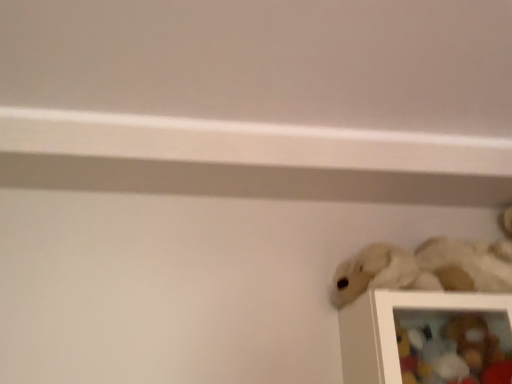
Image resolution: width=512 pixels, height=384 pixels. Find the location of `white plush toy at lower right, which is the 2th toy in top-to-bottom order`. white plush toy at lower right, which is the 2th toy in top-to-bottom order is located at coordinates (412, 353).

You are a GUI agent. You are given a task and a screenshot of the screen. Output one action in this format:
    pyautogui.click(x=<x>, y=<y>)
    Task: Click on the soft plush toy at lower right, the first toy when ordered from bottom to top
    Image resolution: width=512 pixels, height=384 pixels.
    Given the screenshot: What is the action you would take?
    [x=453, y=347]

Measure the distance between point (359, 264) and camera.

The distance of point (359, 264) from camera is 1.26 meters.

Where is `white plush toy at lower right, which is the 2th toy in top-to-bottom order`? The image size is (512, 384). white plush toy at lower right, which is the 2th toy in top-to-bottom order is located at coordinates (412, 353).

Consider the image. From a real-world perspective, is white plush toy at lower right, placed as the 2th toy when sorted from bottom to top, under fuzzy white stuffed animal at lower right, acting as the first toy starting from the top?

Yes, from a real-world perspective, white plush toy at lower right, placed as the 2th toy when sorted from bottom to top, is below fuzzy white stuffed animal at lower right, acting as the first toy starting from the top.

Based on the photo, can you confirm if white plush toy at lower right, which is the 2th toy in top-to-bottom order, is taller than fuzzy white stuffed animal at lower right, acting as the first toy starting from the top?

No.

Which point is more distant from viewer, [400,332] or [402,249]?

Positioned behind is point [402,249].

From the image's perspective, which one is positioned higher, white plush toy at lower right, which is the 2th toy in top-to-bottom order, or fuzzy white stuffed animal at lower right, acting as the first toy starting from the top?

From the image's view, fuzzy white stuffed animal at lower right, acting as the first toy starting from the top, is above.

What's the angular difference between soft plush toy at lower right, which appears as the third toy when viewed from the top, and white plush toy at lower right, placed as the 2th toy when sorted from bottom to top,'s facing directions?

2 degrees.

Is soft plush toy at lower right, the first toy when ordered from bottom to top, taller than white plush toy at lower right, placed as the 2th toy when sorted from bottom to top?

Yes, soft plush toy at lower right, the first toy when ordered from bottom to top, is taller than white plush toy at lower right, placed as the 2th toy when sorted from bottom to top.

Does soft plush toy at lower right, which appears as the third toy when viewed from the top, touch white plush toy at lower right, which is the 2th toy in top-to-bottom order?

Yes, soft plush toy at lower right, which appears as the third toy when viewed from the top, and white plush toy at lower right, which is the 2th toy in top-to-bottom order, clearly make contact.

Is soft plush toy at lower right, which appears as the third toy when viewed from the top, smaller than white plush toy at lower right, placed as the 2th toy when sorted from bottom to top?

No.

Considering the relative positions of fuzzy white stuffed animal at lower right, acting as the first toy starting from the top, and white plush toy at lower right, placed as the 2th toy when sorted from bottom to top, in the image provided, is fuzzy white stuffed animal at lower right, acting as the first toy starting from the top, to the left of white plush toy at lower right, placed as the 2th toy when sorted from bottom to top, from the viewer's perspective?

In fact, fuzzy white stuffed animal at lower right, acting as the first toy starting from the top, is to the right of white plush toy at lower right, placed as the 2th toy when sorted from bottom to top.

Considering the positions of objects fuzzy white stuffed animal at lower right, acting as the first toy starting from the top, and white plush toy at lower right, placed as the 2th toy when sorted from bottom to top, in the image provided, who is behind, fuzzy white stuffed animal at lower right, acting as the first toy starting from the top, or white plush toy at lower right, placed as the 2th toy when sorted from bottom to top,?

white plush toy at lower right, placed as the 2th toy when sorted from bottom to top, is further from the camera.

Can you tell me how much fuzzy white stuffed animal at lower right, acting as the first toy starting from the top, and white plush toy at lower right, placed as the 2th toy when sorted from bottom to top, differ in facing direction?

The angular difference between fuzzy white stuffed animal at lower right, acting as the first toy starting from the top, and white plush toy at lower right, placed as the 2th toy when sorted from bottom to top, is 1.15 degrees.

From a real-world perspective, who is located higher, fuzzy white stuffed animal at lower right, the 3th toy from the bottom, or white plush toy at lower right, which is the 2th toy in top-to-bottom order?

fuzzy white stuffed animal at lower right, the 3th toy from the bottom.

Which object is wider, white plush toy at lower right, placed as the 2th toy when sorted from bottom to top, or soft plush toy at lower right, the first toy when ordered from bottom to top?

white plush toy at lower right, placed as the 2th toy when sorted from bottom to top, is wider.

From a real-world perspective, is white plush toy at lower right, placed as the 2th toy when sorted from bottom to top, above or below soft plush toy at lower right, which appears as the third toy when viewed from the top?

white plush toy at lower right, placed as the 2th toy when sorted from bottom to top, is above soft plush toy at lower right, which appears as the third toy when viewed from the top.

How distant is white plush toy at lower right, which is the 2th toy in top-to-bottom order, from soft plush toy at lower right, which appears as the third toy when viewed from the top?

white plush toy at lower right, which is the 2th toy in top-to-bottom order, and soft plush toy at lower right, which appears as the third toy when viewed from the top, are 9.29 centimeters apart from each other.

Where is `toy that is the 1st object to the left of the soft plush toy at lower right, which appears as the third toy when viewed from the top, starting at the anchor`? The width and height of the screenshot is (512, 384). toy that is the 1st object to the left of the soft plush toy at lower right, which appears as the third toy when viewed from the top, starting at the anchor is located at coordinates click(422, 269).

Which object is further away from the camera, fuzzy white stuffed animal at lower right, acting as the first toy starting from the top, or soft plush toy at lower right, which appears as the third toy when viewed from the top?

soft plush toy at lower right, which appears as the third toy when viewed from the top, is behind.

Can you confirm if fuzzy white stuffed animal at lower right, the 3th toy from the bottom, is positioned to the right of soft plush toy at lower right, which appears as the third toy when viewed from the top?

In fact, fuzzy white stuffed animal at lower right, the 3th toy from the bottom, is to the left of soft plush toy at lower right, which appears as the third toy when viewed from the top.

Looking at their sizes, would you say fuzzy white stuffed animal at lower right, acting as the first toy starting from the top, is wider or thinner than soft plush toy at lower right, the first toy when ordered from bottom to top?

In the image, fuzzy white stuffed animal at lower right, acting as the first toy starting from the top, appears to be wider than soft plush toy at lower right, the first toy when ordered from bottom to top.

Is soft plush toy at lower right, which appears as the third toy when viewed from the top, far from fuzzy white stuffed animal at lower right, the 3th toy from the bottom?

No, soft plush toy at lower right, which appears as the third toy when viewed from the top, is not far from fuzzy white stuffed animal at lower right, the 3th toy from the bottom.

Is soft plush toy at lower right, the first toy when ordered from bottom to top, aimed at fuzzy white stuffed animal at lower right, the 3th toy from the bottom?

No, soft plush toy at lower right, the first toy when ordered from bottom to top, is not oriented towards fuzzy white stuffed animal at lower right, the 3th toy from the bottom.

Is soft plush toy at lower right, the first toy when ordered from bottom to top, at the right side of fuzzy white stuffed animal at lower right, acting as the first toy starting from the top?

Correct, you'll find soft plush toy at lower right, the first toy when ordered from bottom to top, to the right of fuzzy white stuffed animal at lower right, acting as the first toy starting from the top.

From a real-world perspective, is soft plush toy at lower right, which appears as the third toy when viewed from the top, above or below fuzzy white stuffed animal at lower right, the 3th toy from the bottom?

From a real-world perspective, soft plush toy at lower right, which appears as the third toy when viewed from the top, is physically below fuzzy white stuffed animal at lower right, the 3th toy from the bottom.

In order to click on the 1st toy behind the fuzzy white stuffed animal at lower right, the 3th toy from the bottom, starting your count from the anchor in this screenshot , I will do (x=412, y=353).

Starting from the soft plush toy at lower right, the first toy when ordered from bottom to top, which toy is the 2nd one to the left? Please provide its 2D coordinates.

[(412, 353)]

Estimate the real-world distances between objects in this image. Which object is closer to fuzzy white stuffed animal at lower right, acting as the first toy starting from the top, soft plush toy at lower right, the first toy when ordered from bottom to top, or white plush toy at lower right, which is the 2th toy in top-to-bottom order?

soft plush toy at lower right, the first toy when ordered from bottom to top, lies closer to fuzzy white stuffed animal at lower right, acting as the first toy starting from the top, than the other object.

Which object lies further to the anchor point fuzzy white stuffed animal at lower right, acting as the first toy starting from the top, white plush toy at lower right, which is the 2th toy in top-to-bottom order, or soft plush toy at lower right, the first toy when ordered from bottom to top?

white plush toy at lower right, which is the 2th toy in top-to-bottom order, lies further to fuzzy white stuffed animal at lower right, acting as the first toy starting from the top, than the other object.

Which object lies further to the anchor point white plush toy at lower right, placed as the 2th toy when sorted from bottom to top, fuzzy white stuffed animal at lower right, the 3th toy from the bottom, or soft plush toy at lower right, the first toy when ordered from bottom to top?

fuzzy white stuffed animal at lower right, the 3th toy from the bottom, is positioned further to the anchor white plush toy at lower right, placed as the 2th toy when sorted from bottom to top.

From the image, which object appears to be nearer to soft plush toy at lower right, which appears as the third toy when viewed from the top, white plush toy at lower right, which is the 2th toy in top-to-bottom order, or fuzzy white stuffed animal at lower right, the 3th toy from the bottom?

white plush toy at lower right, which is the 2th toy in top-to-bottom order, lies closer to soft plush toy at lower right, which appears as the third toy when viewed from the top, than the other object.

Based on their spatial positions, is fuzzy white stuffed animal at lower right, acting as the first toy starting from the top, or white plush toy at lower right, placed as the 2th toy when sorted from bottom to top, closer to soft plush toy at lower right, the first toy when ordered from bottom to top?

white plush toy at lower right, placed as the 2th toy when sorted from bottom to top.

Which object lies further to the anchor point white plush toy at lower right, which is the 2th toy in top-to-bottom order, soft plush toy at lower right, which appears as the third toy when viewed from the top, or fuzzy white stuffed animal at lower right, the 3th toy from the bottom?

fuzzy white stuffed animal at lower right, the 3th toy from the bottom, is positioned further to the anchor white plush toy at lower right, which is the 2th toy in top-to-bottom order.

At what (x,y) coordinates should I click in order to perform the action: click on toy between fuzzy white stuffed animal at lower right, the 3th toy from the bottom, and soft plush toy at lower right, the first toy when ordered from bottom to top, from top to bottom. Please return your answer as a coordinate pair (x, y). Looking at the image, I should click on (412, 353).